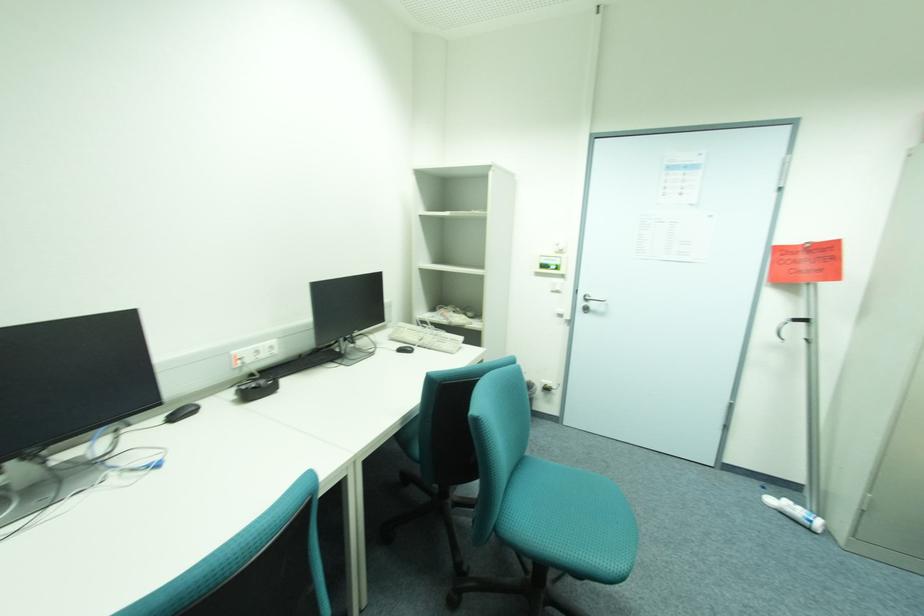
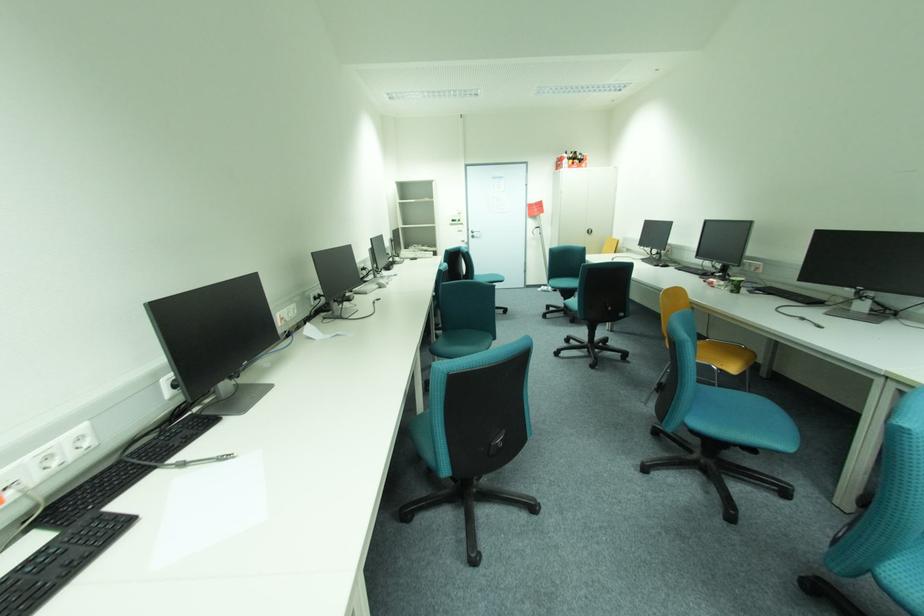
What movement of the cameraman would produce the second image?

The movement direction of the cameraman is left, backward.